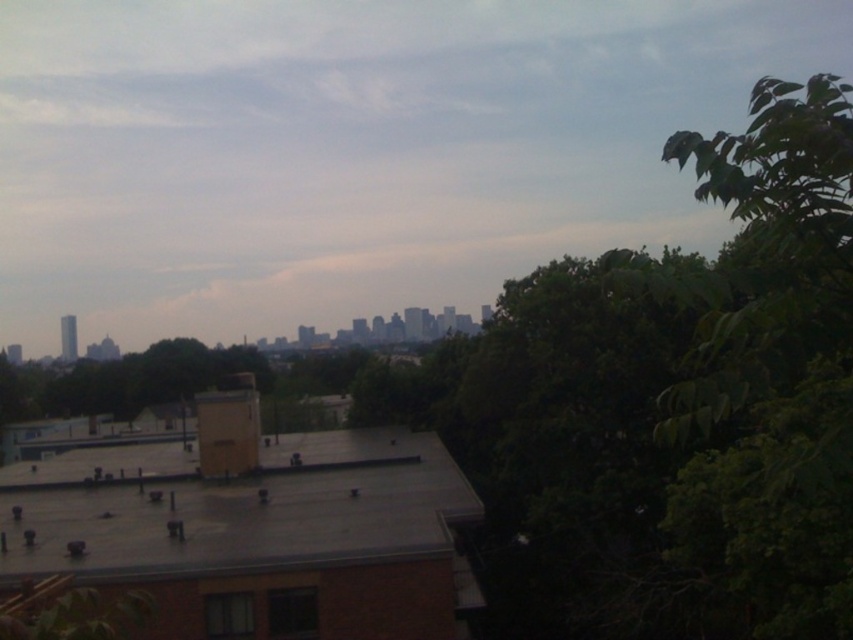
Question: Where is green leafy tree at right located in relation to gray rubber roof at center in the image?

Choices:
 (A) right
 (B) left

Answer: (A)

Question: Which object is farther from the camera taking this photo?

Choices:
 (A) gray rubber roof at center
 (B) green leafy tree at right

Answer: (A)

Question: Which point is closer to the camera taking this photo?

Choices:
 (A) (413, 509)
 (B) (820, 188)

Answer: (B)

Question: Considering the relative positions of green leafy tree at right and gray rubber roof at center in the image provided, where is green leafy tree at right located with respect to gray rubber roof at center?

Choices:
 (A) right
 (B) left

Answer: (A)

Question: Is green leafy tree at right smaller than gray rubber roof at center?

Choices:
 (A) yes
 (B) no

Answer: (B)